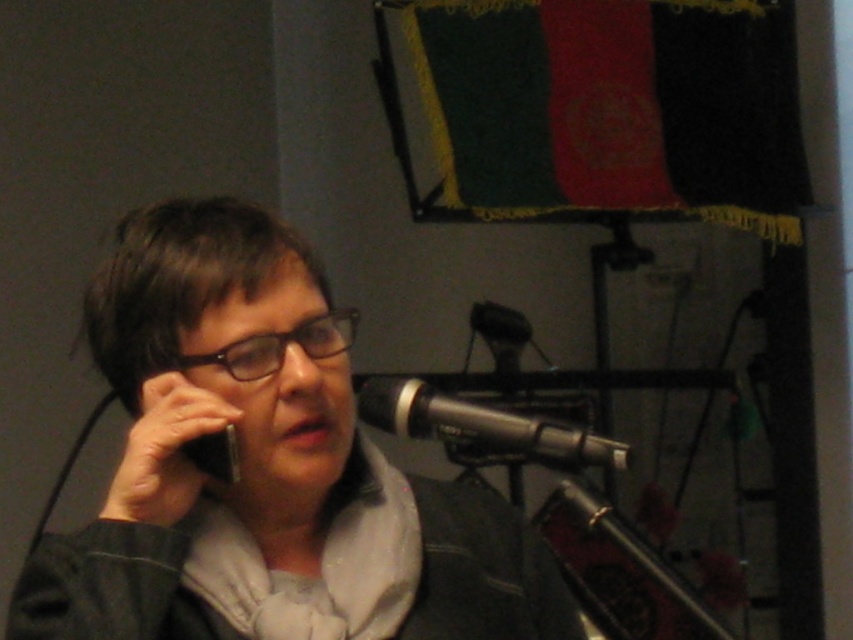
Question: Does black metallic microphone at center appear under black plastic glasses at center?

Choices:
 (A) no
 (B) yes

Answer: (B)

Question: Among these objects, which one is farthest from the camera?

Choices:
 (A) black metallic microphone at center
 (B) matte black phone at center

Answer: (A)

Question: Which point is closer to the camera?

Choices:
 (A) (161, 492)
 (B) (254, 346)
 (C) (495, 444)

Answer: (A)

Question: Can you confirm if matte black phone at center is positioned to the right of black metallic microphone at center?

Choices:
 (A) yes
 (B) no

Answer: (B)

Question: Which point is closer to the camera taking this photo?

Choices:
 (A) (517, 426)
 (B) (352, 332)

Answer: (A)

Question: Is black metallic microphone at center bigger than black matte smartphone at upper left?

Choices:
 (A) no
 (B) yes

Answer: (B)